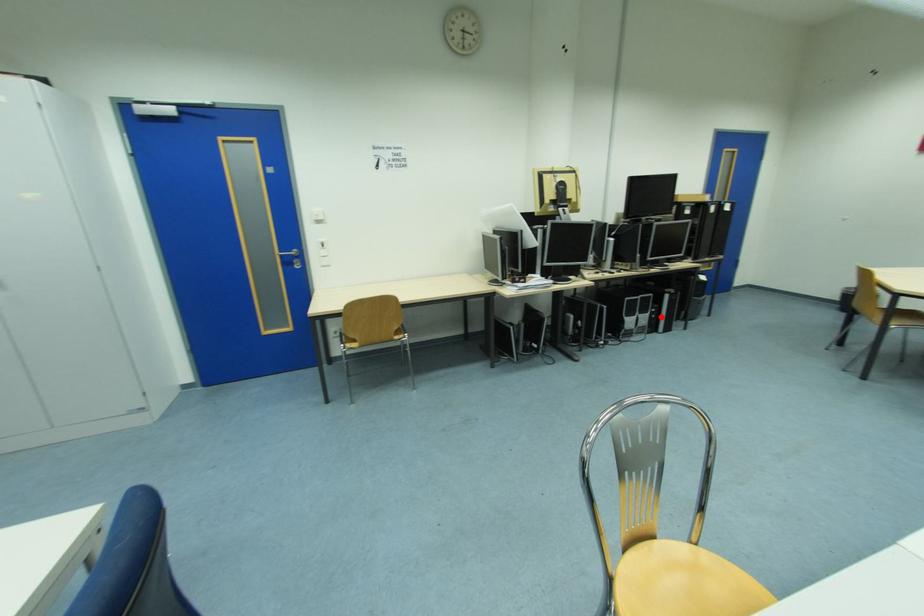
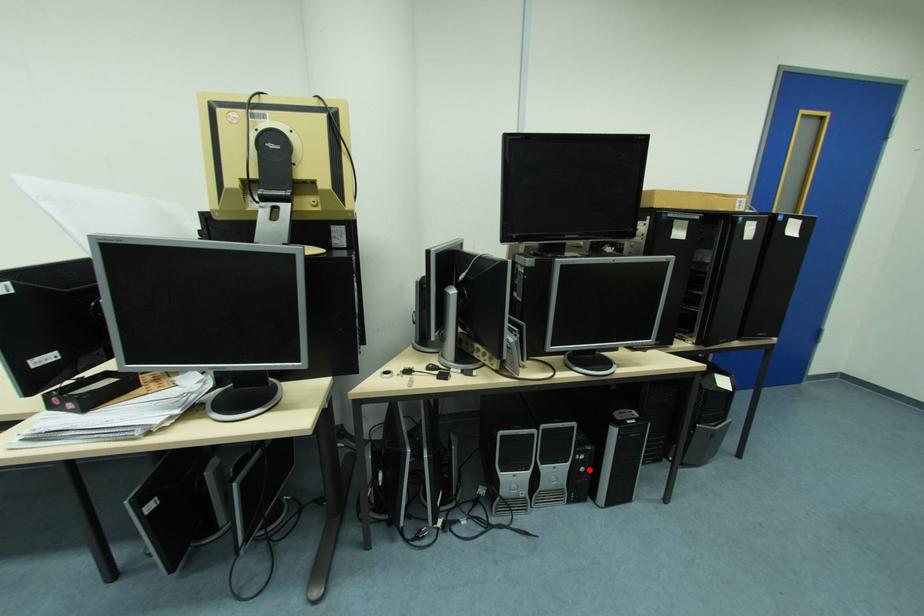
I am providing you with two images of the same scene from different viewpoints. A red point is marked on the first image and another point is marked on the second image. Is the red point in image1 aligned with the point shown in image2?

Yes